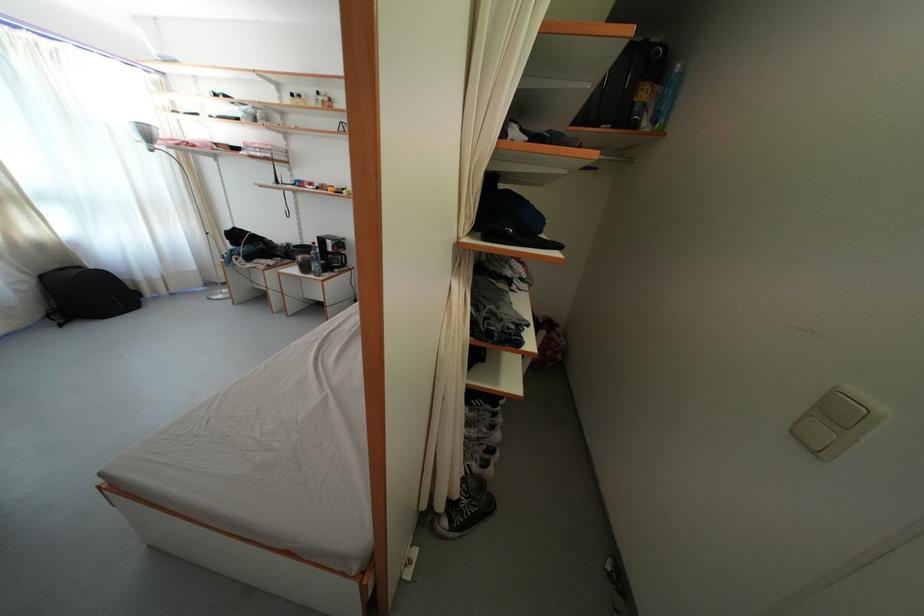
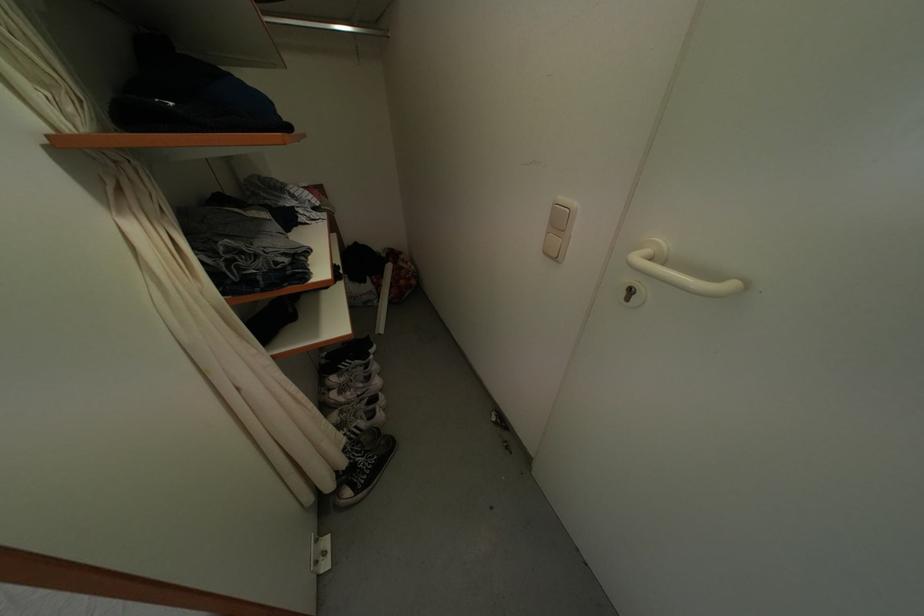
Locate, in the second image, the point that corresponds to point (495, 421) in the first image.

(369, 374)